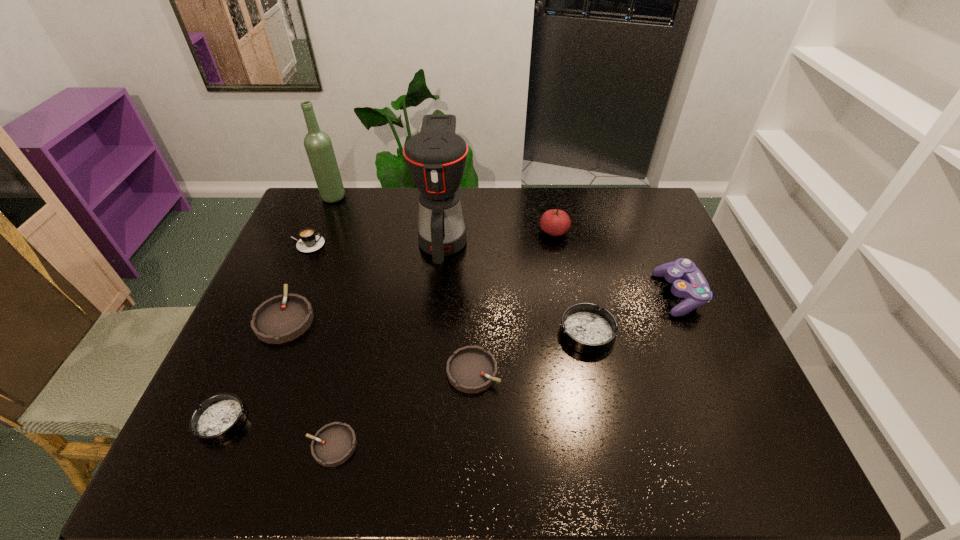
Identify the location of free space at the far right corner of the desktop. (625, 199).

Find the location of `free region at the near right corner of the desktop`. free region at the near right corner of the desktop is located at coordinates (732, 458).

Where is `free space between the coffee maker and the farthest object`? free space between the coffee maker and the farthest object is located at coordinates (388, 217).

Where is `free space between the smaller dark ashtray and the farthest gray ashtray`? This screenshot has width=960, height=540. free space between the smaller dark ashtray and the farthest gray ashtray is located at coordinates (253, 369).

I want to click on empty space between the second biggest gray ashtray and the wine bottle, so click(x=403, y=284).

At what (x,y) coordinates should I click in order to perform the action: click on vacant area that lies between the control and the tomato. Please return your answer as a coordinate pair (x, y). The height and width of the screenshot is (540, 960). Looking at the image, I should click on (616, 264).

At what (x,y) coordinates should I click in order to perform the action: click on free space between the coffee maker and the biggest gray ashtray. Please return your answer as a coordinate pair (x, y). Looking at the image, I should click on pyautogui.click(x=364, y=278).

Locate an element on the screen. unoccupied area between the biggest gray ashtray and the left dark ashtray is located at coordinates (253, 369).

Locate an element on the screen. This screenshot has height=540, width=960. blank region between the farthest object and the farthest gray ashtray is located at coordinates (309, 257).

You are a GUI agent. You are given a task and a screenshot of the screen. Output one action in this format:
    pyautogui.click(x=<x>, y=<y>)
    Task: Click on the empty space between the coffee maker and the second biggest gray ashtray
    
    Given the screenshot: What is the action you would take?
    pyautogui.click(x=458, y=305)